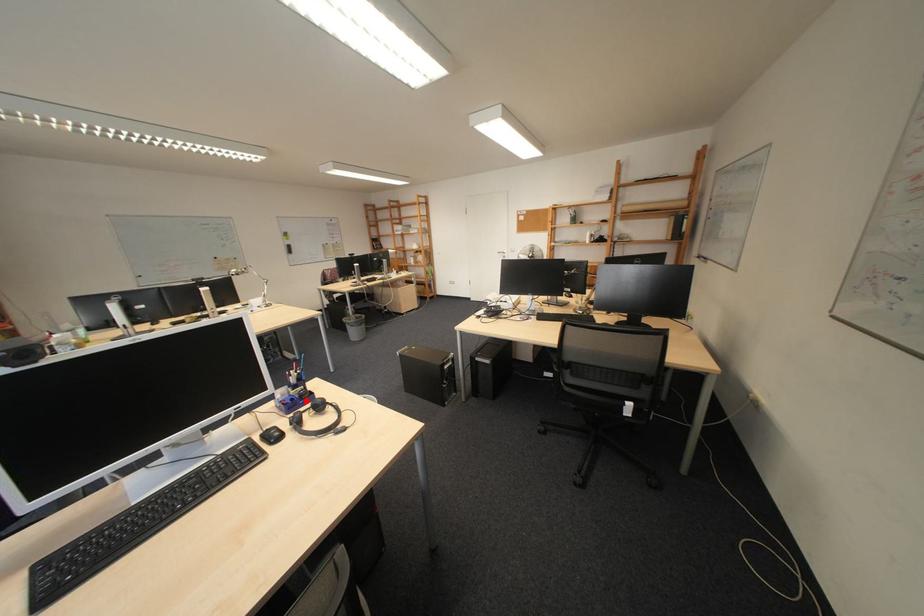
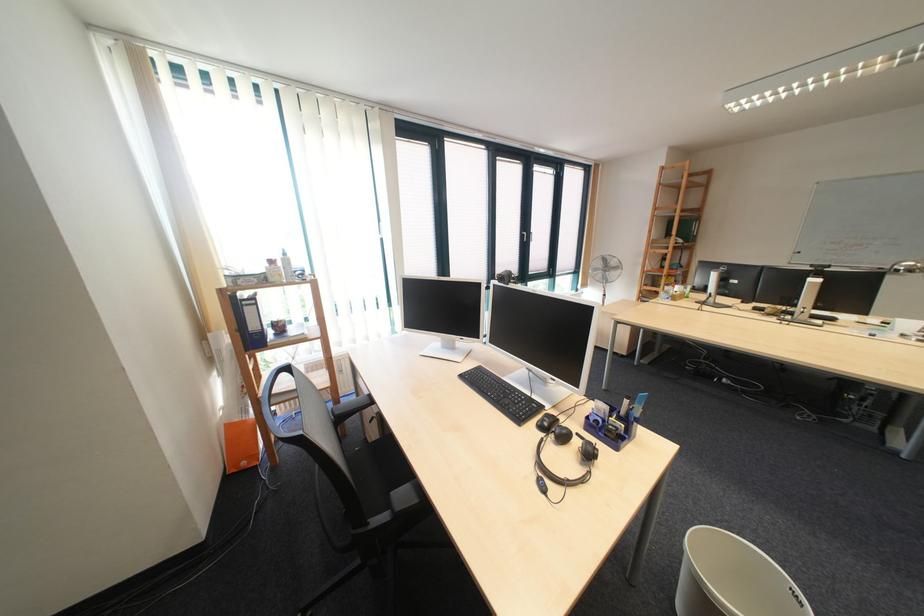
Question: I am providing you with two images of the same scene from different viewpoints. A red point is shown in image1. For the corresponding object point in image2, is it positioned nearer or farther from the camera?

Choices:
 (A) Nearer
 (B) Farther

Answer: (B)